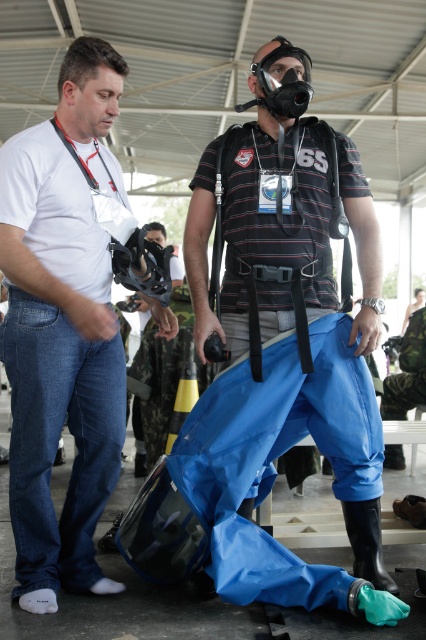
You are designing a storage system for these items. Given that the blue rubber pants at center and the white matte shirt at left need to be stored in the same compartment, which item should be placed first to optimize space?

The blue rubber pants at center should be placed first because it occupies less space than the white matte shirt at left, allowing the larger item to be placed around it more efficiently.